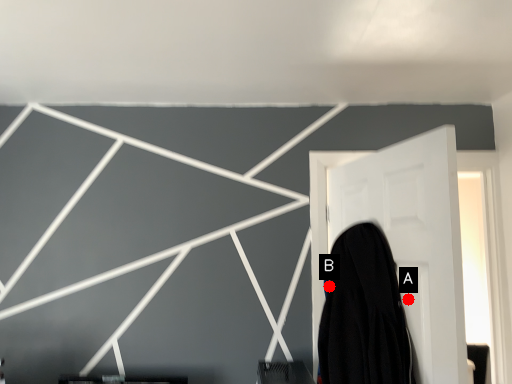
Question: Two points are circled on the image, labeled by A and B beside each circle. Among these points, which one is nearest to the camera?

Choices:
 (A) A is closer
 (B) B is closer

Answer: (A)